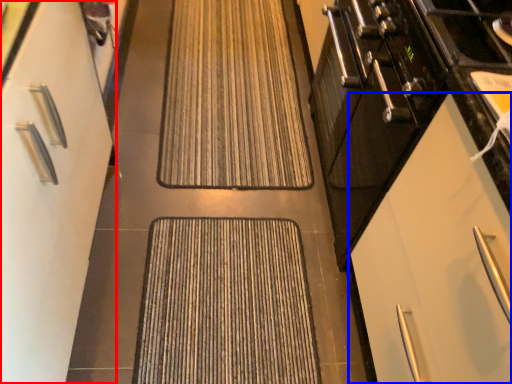
Question: Which point is further to the camera, cabinetry (highlighted by a red box) or cabinetry (highlighted by a blue box)?

Choices:
 (A) cabinetry
 (B) cabinetry

Answer: (B)